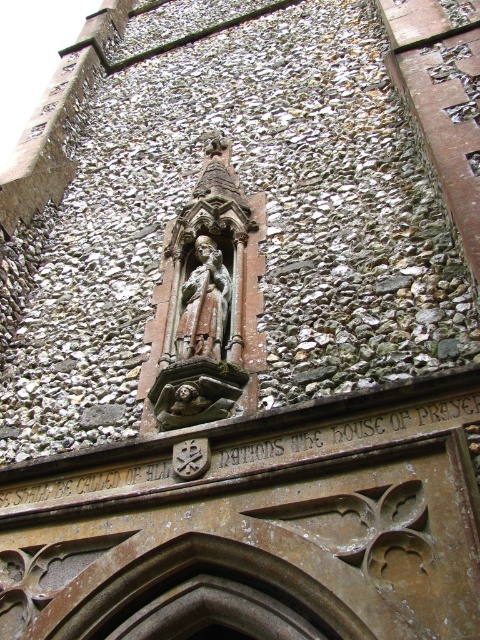
You are an architect examining the stone wall. You notice both the carved stone statue at center and the brown stone gargoyle at center. Which one do you think is larger in size?

The carved stone statue at center is bigger than the brown stone gargoyle at center, so the carved stone statue at center is larger in size.

You are an architect examining the stone wall and want to place two markers at point (223, 301) and point (155, 392). Which point is closer to the viewer?

Point (155, 392) is closer to the viewer because it is in front of point (223, 301).

Looking at this image, you are a painter standing 3 meters away from the carved stone statue at center and the brown stone gargoyle at center. You want to paint both statues but can only move forward or backward. Which statue will you be closer to after moving 3 meters towards the one farther away?

The carved stone statue at center and brown stone gargoyle at center are 6.76 meters apart. Since you are initially 3 meters away from both, moving 3 meters toward the farther statue would mean you were originally 3 meters from one and 6.76 meters from the other. Wait, but the problem states you are 3 meters from both initially. There might be an inconsistency here.